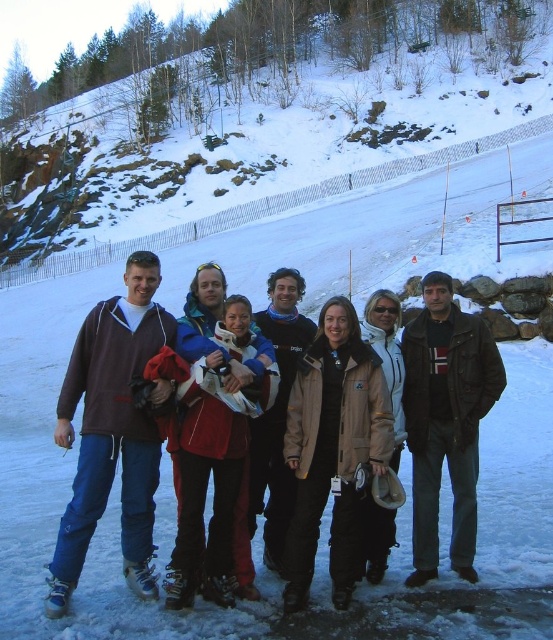
You are standing in the snowy scene and want to take a photo of the group. You notice the matte blue jacket at center and the dark brown leather jacket at center. Which jacket should you focus on first if you want to capture both in the frame without moving the camera?

The matte blue jacket at center is to the left of the dark brown leather jacket at center, so you should focus on the matte blue jacket at center first to ensure both are in the frame.

You are a photographer standing in front of the snowy rock at center and the blue fleece jacket at center. You want to take a photo of the group but need to ensure both objects are in focus. Which object should you focus on first to make sure both are sharp?

The snowy rock at center is further to the viewer than the blue fleece jacket at center, so you should focus on the snowy rock at center first to ensure both are in focus.

You are a photographer trying to capture a group photo of the snowy rock at center and the blue fleece jacket at center. If you want to ensure both are fully visible in the frame, which object should you position closer to the camera?

The snowy rock at center might be wider than the blue fleece jacket at center, so to ensure both are fully visible in the frame, position the snowy rock at center closer to the camera to avoid cropping its width.